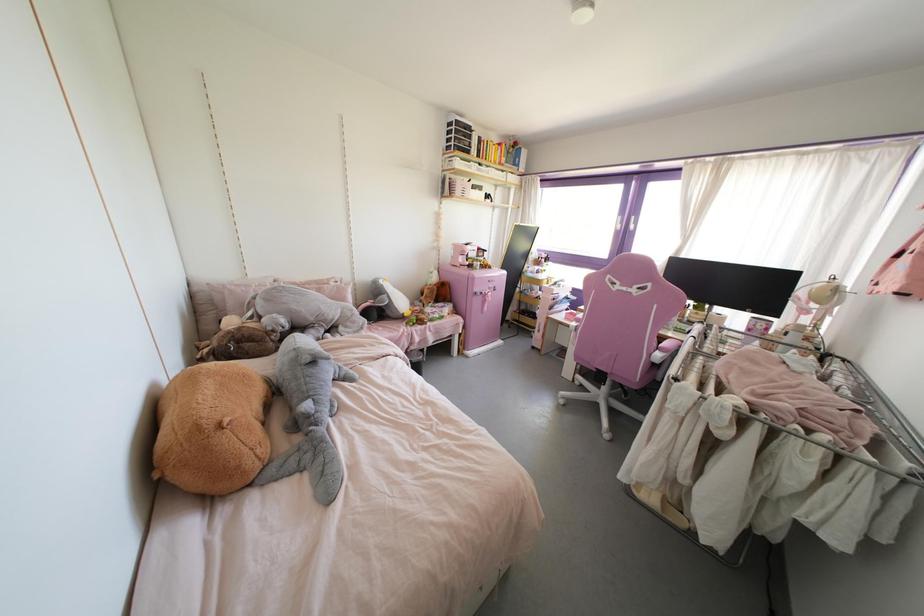
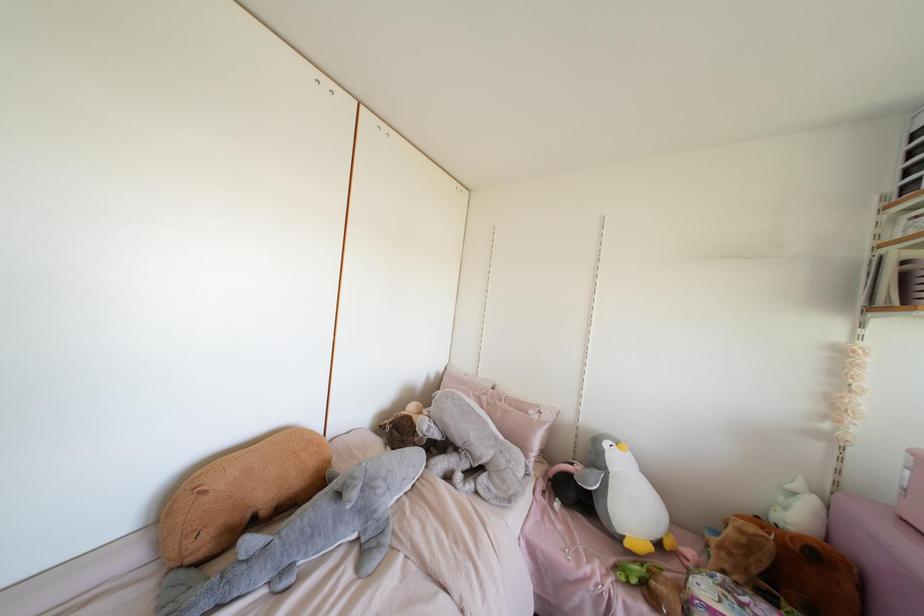
The point at [405,314] is marked in the first image. Where is the corresponding point in the second image?

(626, 544)